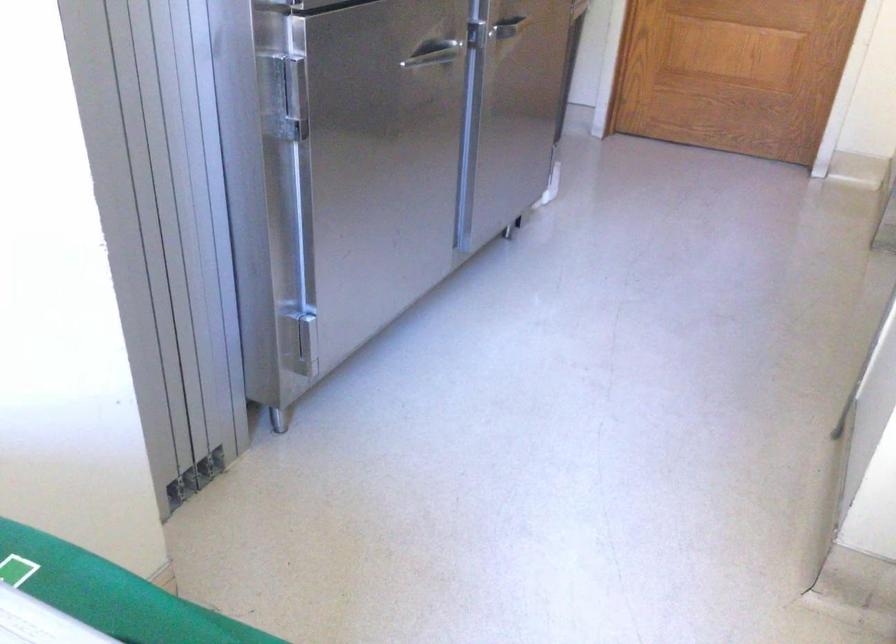
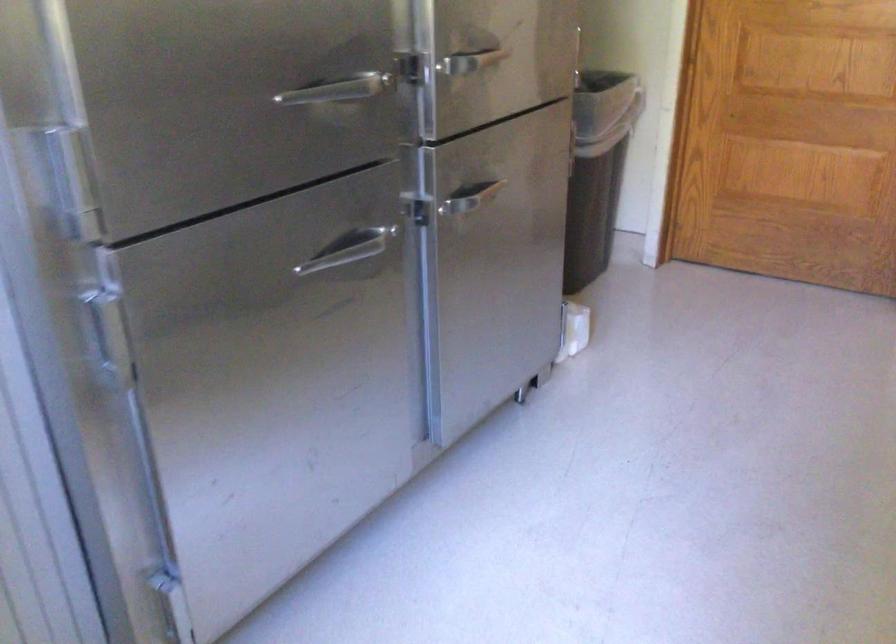
Question: The camera is either moving clockwise (left) or counter-clockwise (right) around the object. The first image is from the beginning of the video and the second image is from the end. Is the camera moving left or right when shooting the video?

Choices:
 (A) Left
 (B) Right

Answer: (B)